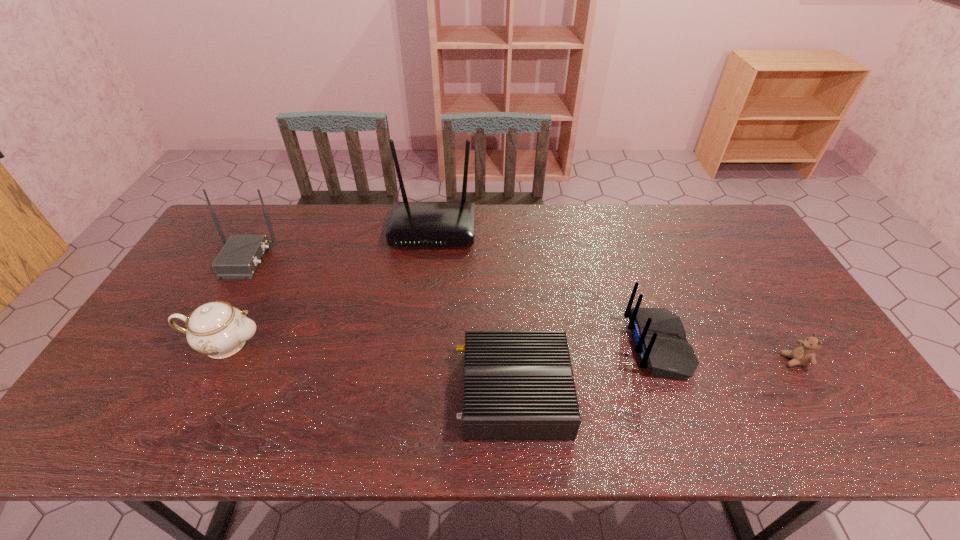
Locate an element on the screen. This screenshot has width=960, height=540. object located at the near edge is located at coordinates (518, 385).

Locate an element on the screen. This screenshot has width=960, height=540. router that is at the left edge is located at coordinates [239, 258].

Identify the location of chinaware present at the left edge. Image resolution: width=960 pixels, height=540 pixels. (216, 329).

The width and height of the screenshot is (960, 540). I want to click on object positioned at the right edge, so click(x=804, y=353).

The height and width of the screenshot is (540, 960). I want to click on object that is at the far left corner, so click(x=239, y=258).

Identify the location of blank space at the far edge of the desktop. The width and height of the screenshot is (960, 540). [x=280, y=225].

The height and width of the screenshot is (540, 960). I want to click on vacant region at the near edge of the desktop, so click(x=441, y=447).

At what (x,y) coordinates should I click in order to perform the action: click on vacant space at the left edge of the desktop. Please return your answer as a coordinate pair (x, y). This screenshot has height=540, width=960. Looking at the image, I should click on (134, 395).

Find the location of a particular element. The image size is (960, 540). vacant space at the right edge of the desktop is located at coordinates (748, 294).

Identify the location of vacant area at the far right corner of the desktop. This screenshot has height=540, width=960. (716, 220).